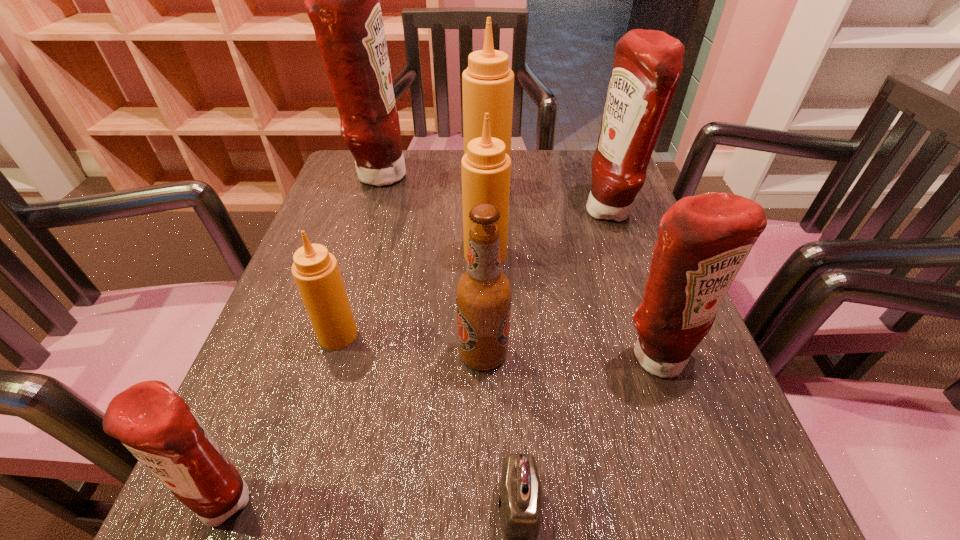
The width and height of the screenshot is (960, 540). Find the location of `vacant position located 0.230m on the front of the leftmost tan condiment`. vacant position located 0.230m on the front of the leftmost tan condiment is located at coordinates (291, 496).

Where is `blank space located on the right of the nearest red condiment`? This screenshot has height=540, width=960. blank space located on the right of the nearest red condiment is located at coordinates (407, 497).

Locate an element on the screen. object that is at the near edge is located at coordinates (156, 425).

Where is `object that is positioned at the far left corner`? This screenshot has height=540, width=960. object that is positioned at the far left corner is located at coordinates pyautogui.click(x=342, y=1).

Locate an element on the screen. Image resolution: width=960 pixels, height=540 pixels. object that is at the near left corner is located at coordinates (156, 425).

The height and width of the screenshot is (540, 960). I want to click on object located at the far right corner, so click(647, 65).

Locate an element on the screen. free space at the far edge of the desktop is located at coordinates (556, 166).

This screenshot has height=540, width=960. Find the location of `free region at the near edge`. free region at the near edge is located at coordinates (628, 498).

In the image, there is a desktop. Where is `vacant space at the left edge`? The height and width of the screenshot is (540, 960). vacant space at the left edge is located at coordinates (228, 419).

Find the location of a particular element. blank space at the right edge of the desktop is located at coordinates (695, 415).